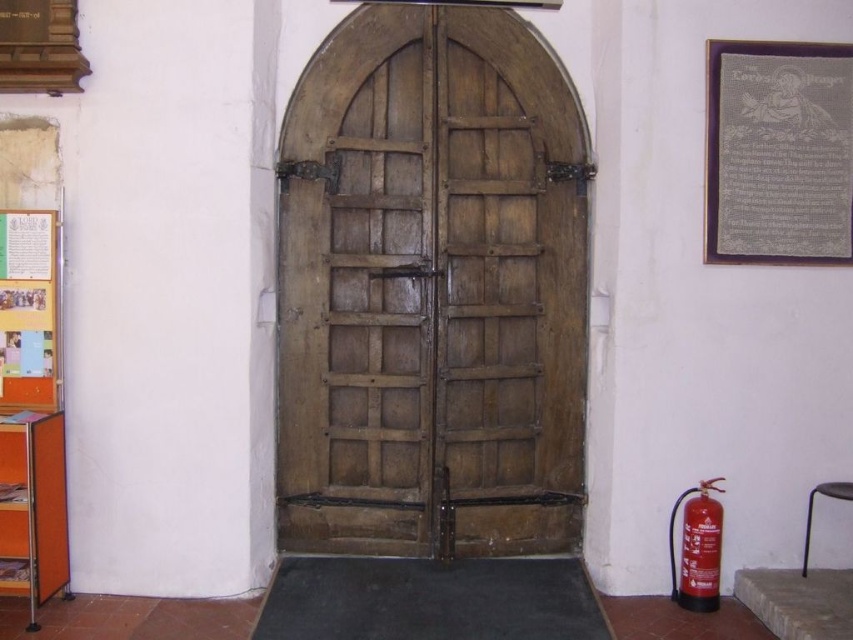
You are a maintenance worker needing to reach the red matte fire extinguisher at lower right to check its pressure gauge. The metallic gray stool at lower right is available. Can you use the stool to reach the extinguisher if you stand on it?

The red matte fire extinguisher at lower right and metallic gray stool at lower right are 19.66 inches apart. Since the distance between them is about 19.66 inches, you would need to move the stool closer to the extinguisher to reach it safely.

You are a visitor at this location and want to read the information on the multicolored paper at left. However, the silver metallic plaque at upper right is blocking your view. Can you move the plaque to get a better look?

The silver metallic plaque at upper right is positioned over the multicolored paper at left, so moving it would allow you to see the paper more clearly.

You are a visitor at the church and want to sit on the metallic gray stool at lower right. Can you approach the stool without going through the wooden door at center?

The wooden door at center is located above the metallic gray stool at lower right, so you can approach the stool without needing to go through the door since it is positioned below the door.